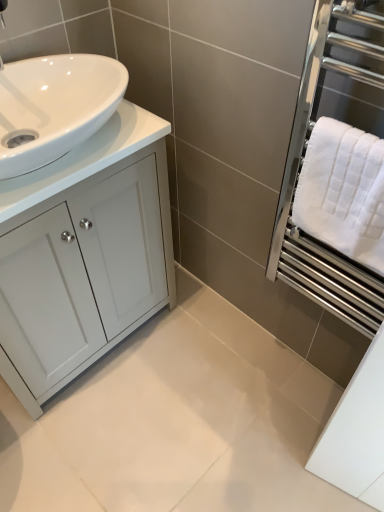
Question: Is white glossy countertop at left surrounded by white textured towel at right?

Choices:
 (A) yes
 (B) no

Answer: (B)

Question: From the image's perspective, would you say white textured towel at right is shown under white glossy countertop at left?

Choices:
 (A) no
 (B) yes

Answer: (B)

Question: From a real-world perspective, is white textured towel at right below white glossy countertop at left?

Choices:
 (A) no
 (B) yes

Answer: (B)

Question: Is white textured towel at right at the right side of white glossy countertop at left?

Choices:
 (A) yes
 (B) no

Answer: (A)

Question: From the image's perspective, is white textured towel at right above white glossy countertop at left?

Choices:
 (A) no
 (B) yes

Answer: (A)

Question: In terms of width, does white textured towel at right look wider or thinner when compared to white glossy cabinet at left?

Choices:
 (A) thin
 (B) wide

Answer: (A)

Question: Considering the positions of white textured towel at right and white glossy cabinet at left in the image, is white textured towel at right taller or shorter than white glossy cabinet at left?

Choices:
 (A) tall
 (B) short

Answer: (B)

Question: Is white textured towel at right inside or outside of white glossy cabinet at left?

Choices:
 (A) inside
 (B) outside

Answer: (B)

Question: From the image's perspective, is white textured towel at right located above or below white glossy cabinet at left?

Choices:
 (A) below
 (B) above

Answer: (B)

Question: Relative to white glossy cabinet at left, is white textured towel at right in front or behind?

Choices:
 (A) front
 (B) behind

Answer: (A)

Question: From a real-world perspective, relative to white glossy cabinet at left, is white textured towel at right vertically above or below?

Choices:
 (A) above
 (B) below

Answer: (A)

Question: In terms of height, does white textured towel at right look taller or shorter compared to white glossy cabinet at left?

Choices:
 (A) short
 (B) tall

Answer: (A)

Question: Based on their sizes in the image, would you say white textured towel at right is bigger or smaller than white glossy cabinet at left?

Choices:
 (A) small
 (B) big

Answer: (A)

Question: From the image's perspective, is white textured towel at right above or below white textured towel at right?

Choices:
 (A) above
 (B) below

Answer: (B)

Question: Considering the relative positions of white textured towel at right and white textured towel at right in the image provided, is white textured towel at right to the left or to the right of white textured towel at right?

Choices:
 (A) right
 (B) left

Answer: (B)